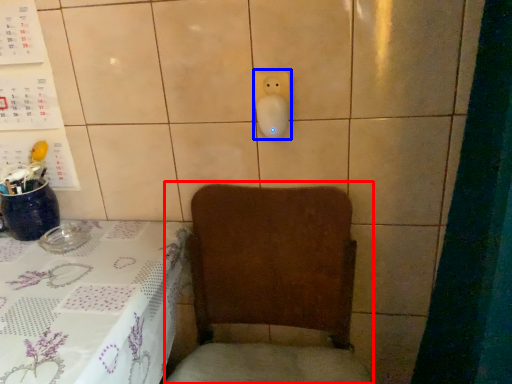
Question: Which object appears farthest to the camera in this image, armchair (highlighted by a red box) or electric outlet (highlighted by a blue box)?

Choices:
 (A) armchair
 (B) electric outlet

Answer: (B)